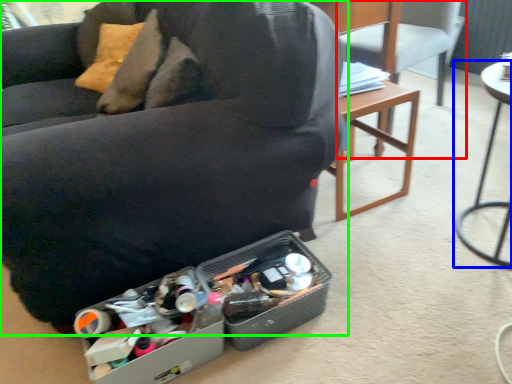
Question: Which object is positioned closest to chair (highlighted by a red box)? Select from table (highlighted by a blue box) and chair (highlighted by a green box).

Choices:
 (A) table
 (B) chair

Answer: (A)